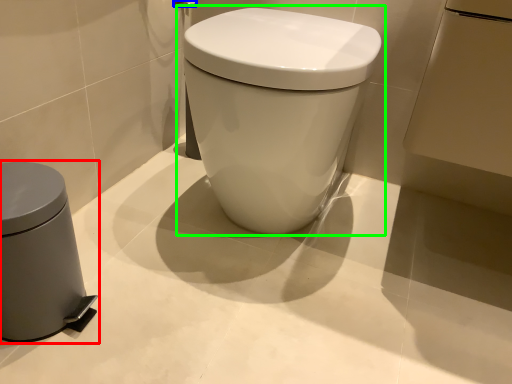
Question: Which is farther away from waste container (highlighted by a red box)? towel bar (highlighted by a blue box) or toilet (highlighted by a green box)?

Choices:
 (A) towel bar
 (B) toilet

Answer: (A)